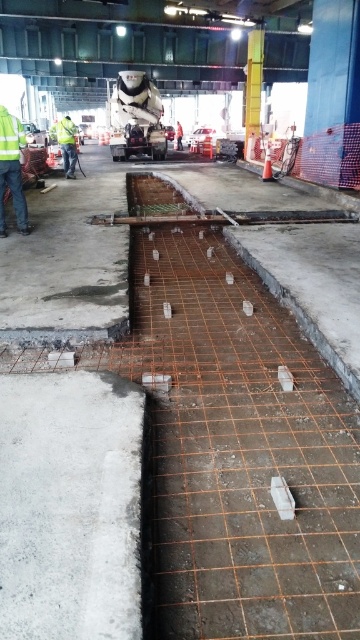
At what (x,y) coordinates should I click in order to perform the action: click on white smooth concrete at lower left. Please return your answer as a coordinate pair (x, y). Looking at the image, I should click on (69, 506).

Can you confirm if white smooth concrete at lower left is positioned to the right of high visibility yellow jacket at left?

Yes, white smooth concrete at lower left is to the right of high visibility yellow jacket at left.

This screenshot has width=360, height=640. I want to click on white smooth concrete at lower left, so click(69, 506).

Locate an element on the screen. white smooth concrete at lower left is located at coordinates (69, 506).